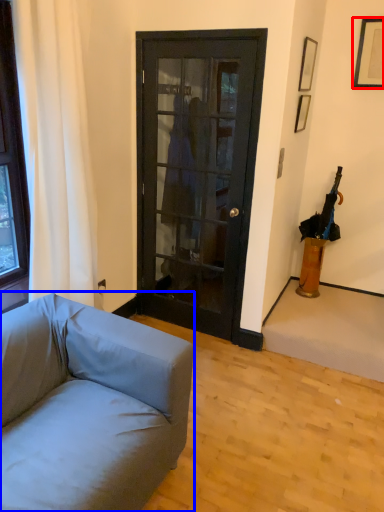
Question: Which object appears farthest to the camera in this image, picture frame (highlighted by a red box) or studio couch (highlighted by a blue box)?

Choices:
 (A) picture frame
 (B) studio couch

Answer: (A)